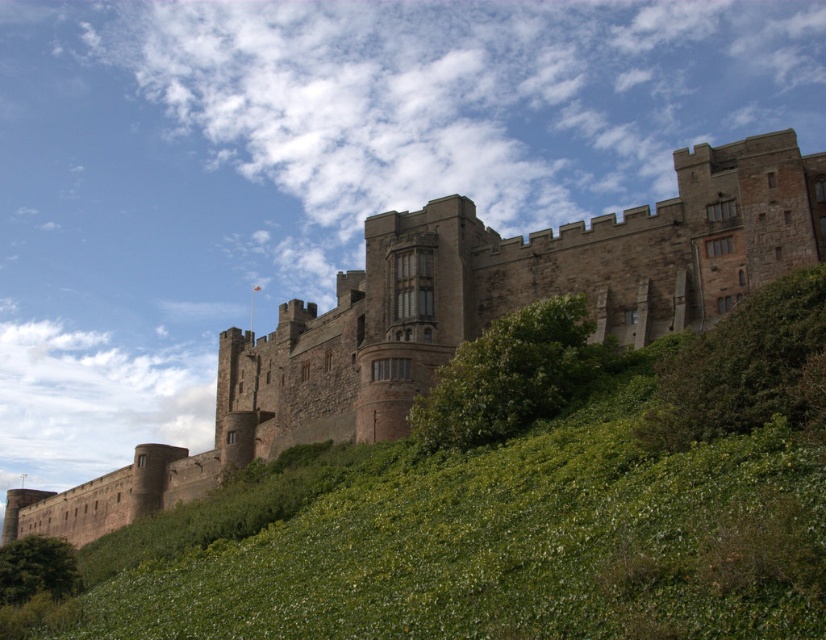
Is point (447, 401) more distant than point (22, 593)?

Yes.

This screenshot has width=826, height=640. What do you see at coordinates (509, 376) in the screenshot?
I see `green leafy hedge at center` at bounding box center [509, 376].

The height and width of the screenshot is (640, 826). Identify the location of green leafy hedge at center. (509, 376).

Is the position of green leafy grass at lower center less distant than that of green leafy hedge at lower left?

Yes, green leafy grass at lower center is in front of green leafy hedge at lower left.

Is green leafy grass at lower center shorter than green leafy hedge at lower left?

In fact, green leafy grass at lower center may be taller than green leafy hedge at lower left.

What do you see at coordinates (483, 538) in the screenshot? I see `green leafy grass at lower center` at bounding box center [483, 538].

Identify the location of green leafy grass at lower center. (483, 538).

Which of these two, green leafy grass at lower center or green leafy hedge at center, stands shorter?

Standing shorter between the two is green leafy hedge at center.

Does green leafy grass at lower center appear on the right side of green leafy hedge at center?

Incorrect, green leafy grass at lower center is not on the right side of green leafy hedge at center.

Describe the element at coordinates (483, 538) in the screenshot. I see `green leafy grass at lower center` at that location.

Identify the location of green leafy grass at lower center. This screenshot has height=640, width=826. (483, 538).